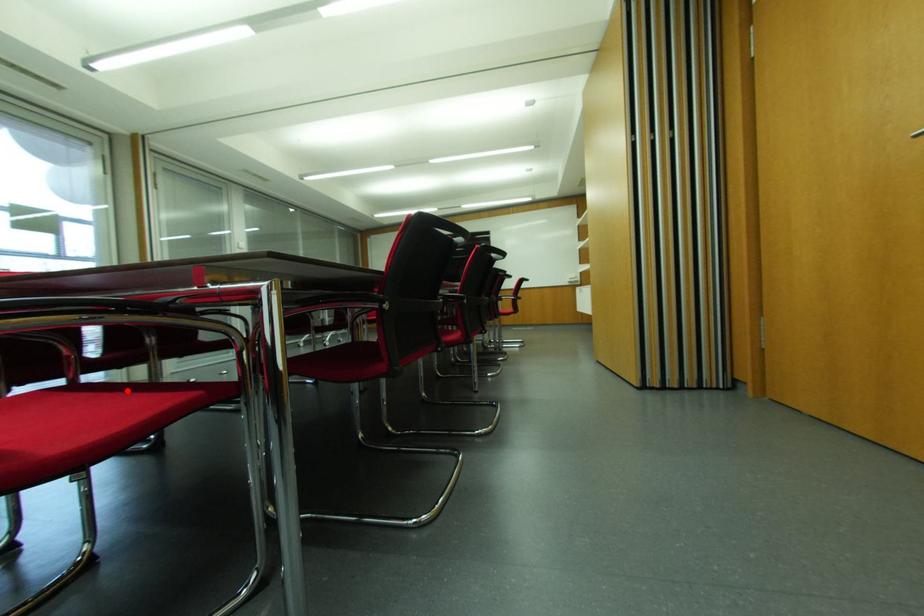
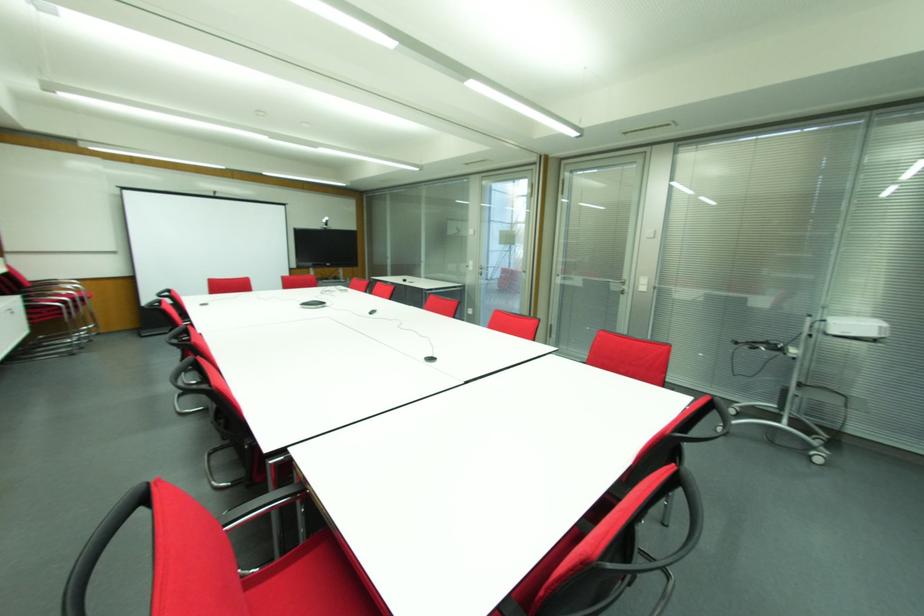
Question: I am providing you with two images of the same scene from different viewpoints. A red point is marked on the first image. At the location where the point appears in image 1, is it still visible in image 2?

Choices:
 (A) Yes
 (B) No

Answer: (B)